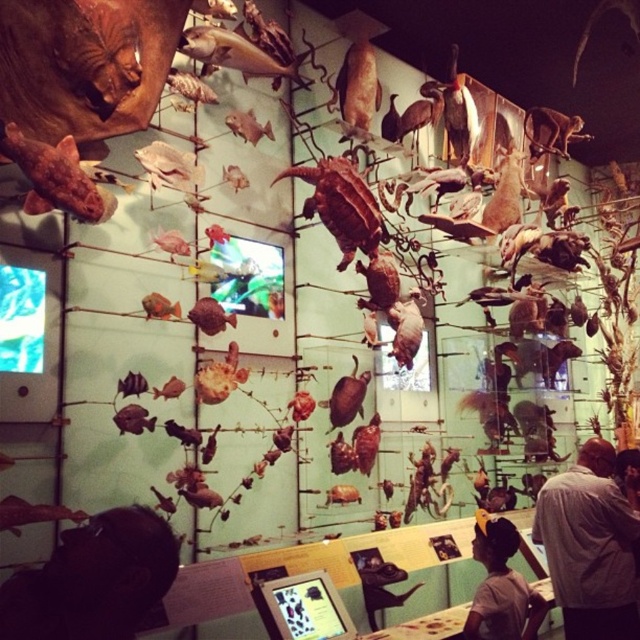
Question: Observing the image, what is the correct spatial positioning of gray shirt at lower right in reference to brown matte turtle at center?

Choices:
 (A) right
 (B) left

Answer: (A)

Question: Can you confirm if gray shirt at lower right is positioned to the left of dark brown hair at lower center?

Choices:
 (A) no
 (B) yes

Answer: (A)

Question: Which point is farther to the camera?

Choices:
 (A) (476, 520)
 (B) (600, 595)
 (C) (353, 248)

Answer: (A)

Question: Which is farther from the dark brown hair at lower center?

Choices:
 (A) brown matte turtle at center
 (B) matte brown fish at upper left
 (C) gray shirt at lower right

Answer: (B)

Question: Can you confirm if gray shirt at lower right is wider than brown matte turtle at center?

Choices:
 (A) no
 (B) yes

Answer: (A)

Question: Estimate the real-world distances between objects in this image. Which object is closer to the gray shirt at lower right?

Choices:
 (A) dark brown hair at lower center
 (B) brown matte turtle at center

Answer: (A)